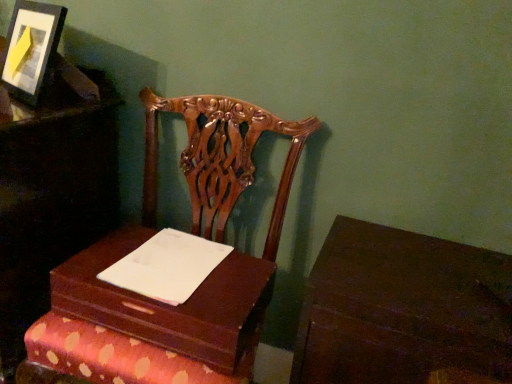
At what (x,y) coordinates should I click in order to perform the action: click on vacant point above wooden box at center (from a real-world perspective). Please return your answer as a coordinate pair (x, y). Looking at the image, I should click on (160, 270).